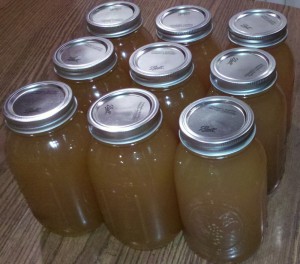
Find the location of a particular element. This screenshot has width=300, height=264. leftmost row of jars is located at coordinates (68, 146), (102, 85), (126, 48).